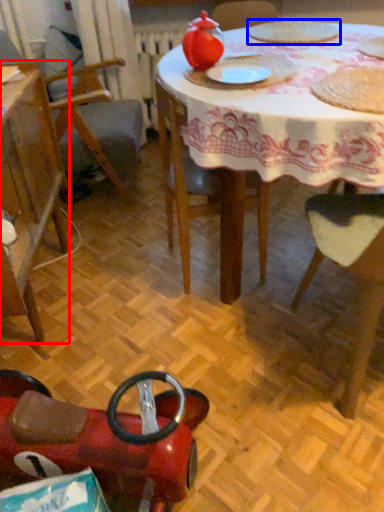
Question: Which of the following is the farthest to the observer, chair (highlighted by a red box) or food (highlighted by a blue box)?

Choices:
 (A) chair
 (B) food

Answer: (B)